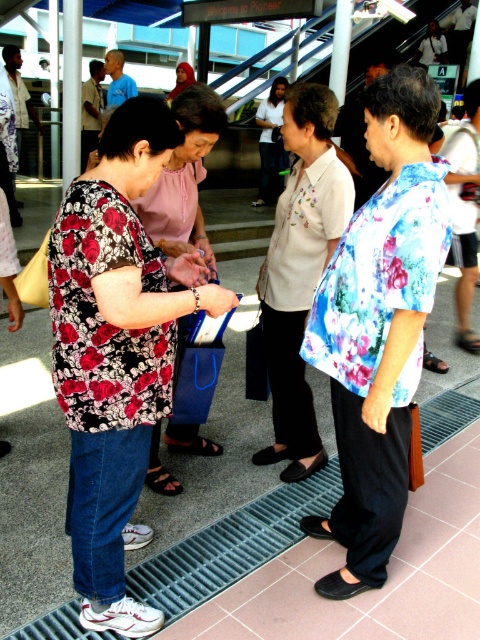
Between point (115, 582) and point (280, 93), which one is positioned in front?

Point (115, 582)

Which of these two, floral-patterned shirt at center or white cotton shirt at center, stands shorter?

floral-patterned shirt at center is shorter.

Who is more distant from viewer, (84,436) or (257,205)?

Positioned behind is point (257,205).

Identify the location of floral-patterned shirt at center. (117, 352).

Which of these two, floral fabric purse at center or white cotton shirt at center, stands shorter?

With less height is floral fabric purse at center.

Does point (144, 204) come in front of point (262, 172)?

Yes, it is.

This screenshot has height=640, width=480. What do you see at coordinates (184, 179) in the screenshot?
I see `floral fabric purse at center` at bounding box center [184, 179].

Where is `floral fabric purse at center`? Image resolution: width=480 pixels, height=640 pixels. floral fabric purse at center is located at coordinates (184, 179).

This screenshot has width=480, height=640. Describe the element at coordinates (117, 352) in the screenshot. I see `floral-patterned shirt at center` at that location.

Does point (78, 212) come closer to viewer compared to point (181, 99)?

Yes.

Who is more forward, (152, 429) or (159, 221)?

Point (152, 429) is in front.

This screenshot has width=480, height=640. Identify the location of floral-patterned shirt at center. (117, 352).